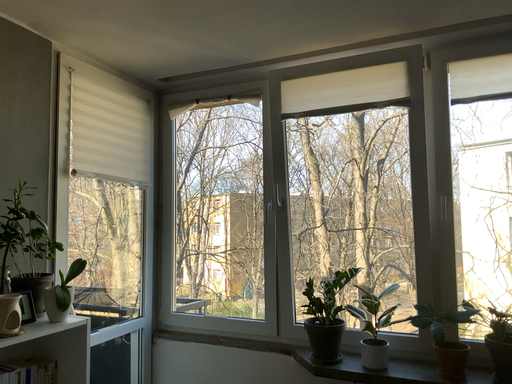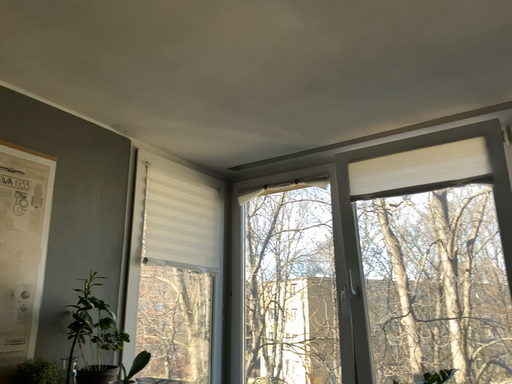
Question: Which way did the camera rotate in the video?

Choices:
 (A) rotated right
 (B) rotated left

Answer: (B)